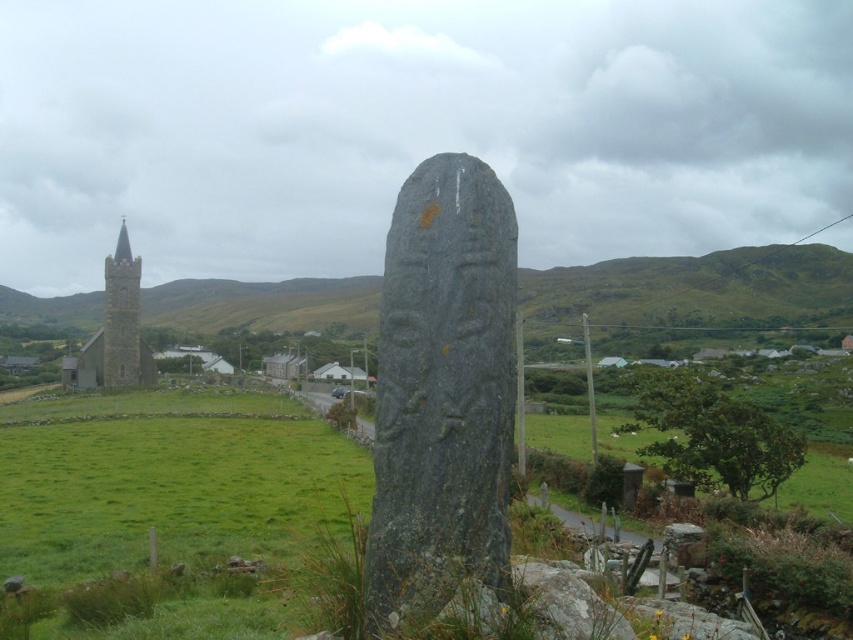
You are standing at the center of the image and want to walk to the green grassy hillside at left. According to the coordinates provided, in which direction should you head?

The green grassy hillside at left is located at coordinates point (694, 296), which means you should head towards the left side of the image to reach it.

You are standing at the monument in the center of the image. You see two points marked on the ground in front of you. The first point is at coordinates point (691,280) and the second point is at coordinates point (138,259). Which point is closer to you?

Point (138,259) is closer to you because it is in front of point (691,280), which is behind it.